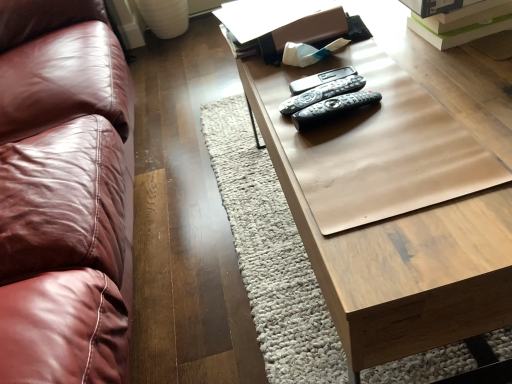
Locate an element on the screen. Image resolution: width=512 pixels, height=384 pixels. vacant location behind black plastic remotes at center, which appears as the first remote when viewed from the front is located at coordinates (317, 74).